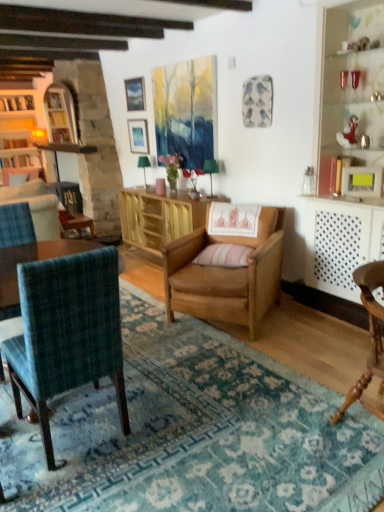
Question: Relative to pink striped pillow at center, is wooden bookshelf at left in front or behind?

Choices:
 (A) behind
 (B) front

Answer: (A)

Question: From their relative heights in the image, would you say wooden bookshelf at left is taller or shorter than pink striped pillow at center?

Choices:
 (A) short
 (B) tall

Answer: (B)

Question: Which of these objects is positioned farthest from the pink striped pillow at center?

Choices:
 (A) light brown wood chair at center, which ranks as the 2th chair in right-to-left order
 (B) teal plaid chair at left, which ranks as the 3th chair in right-to-left order
 (C) wooden cabinet at center
 (D) green fabric lampshade at upper center, which appears as the 2th lamp when viewed from the front
 (E) wooden chair at lower right, marked as the third chair in a left-to-right arrangement

Answer: (D)

Question: Which object is the closest to the light brown wood chair at center, acting as the second chair starting from the left?

Choices:
 (A) wooden bookshelf at left
 (B) teal plaid chair at left, which ranks as the 3th chair in right-to-left order
 (C) wooden chair at lower right, which is counted as the first chair, starting from the right
 (D) green fabric lampshade at center, which appears as the 2th lamp when viewed from the back
 (E) green fabric lampshade at upper center, the second lamp positioned from the right

Answer: (D)